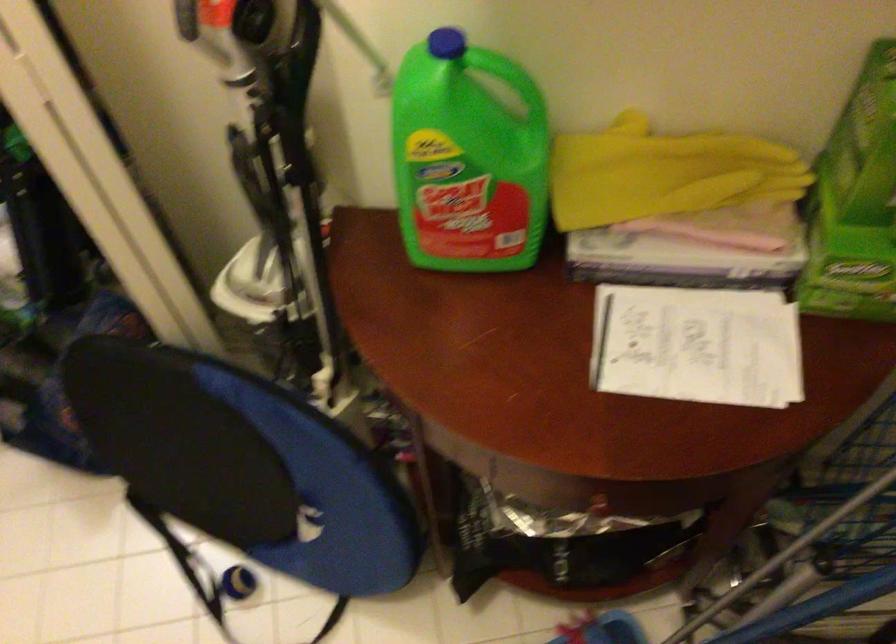
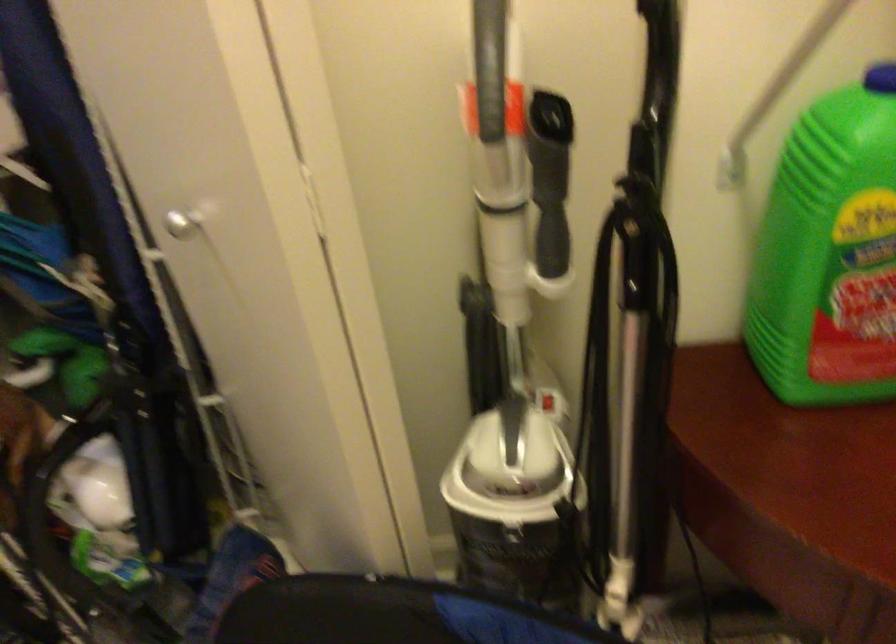
Locate, in the second image, the point that corresponds to point 303,209 in the first image.

(633, 348)